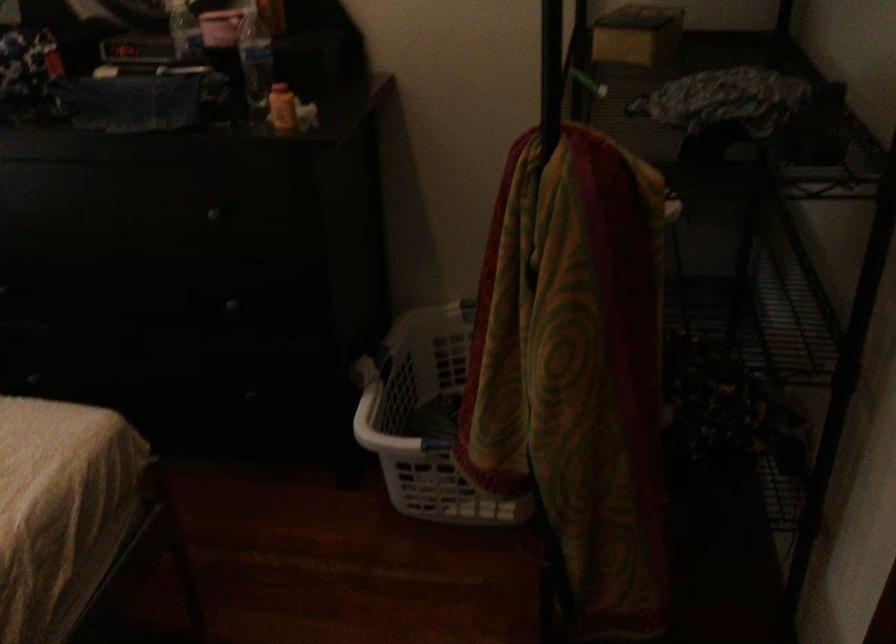
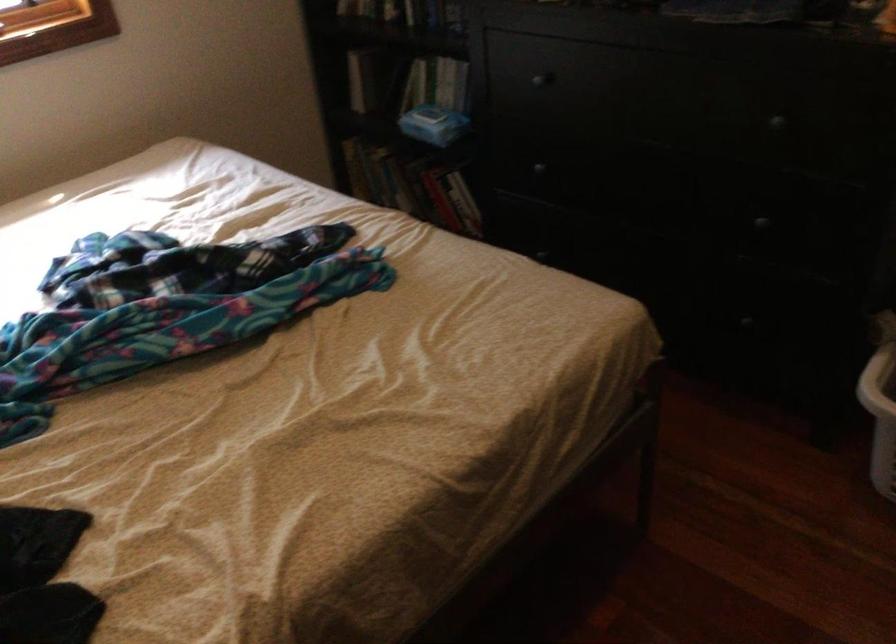
Question: Based on the continuous images, in which direction is the camera rotating? Reply with the corresponding letter.

Choices:
 (A) Left
 (B) Right
 (C) Up
 (D) Down

Answer: (A)